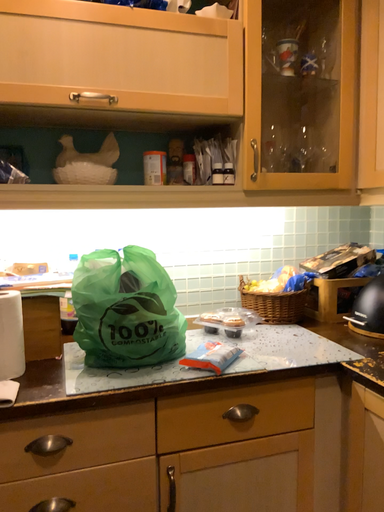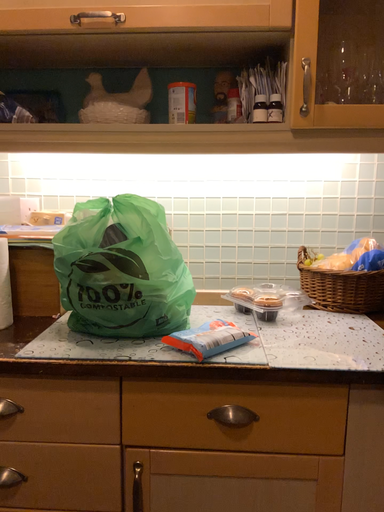
Question: Which way did the camera rotate in the video?

Choices:
 (A) rotated left
 (B) rotated right

Answer: (A)